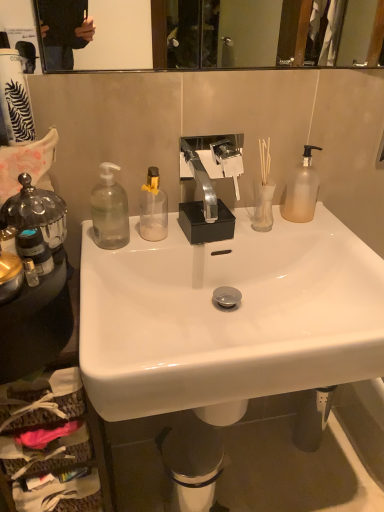
Question: Is white glossy sink at center next to translucent glass vase at center?

Choices:
 (A) no
 (B) yes

Answer: (A)

Question: Considering the relative sizes of white glossy sink at center and translucent glass vase at center in the image provided, is white glossy sink at center taller than translucent glass vase at center?

Choices:
 (A) no
 (B) yes

Answer: (B)

Question: Is the depth of white glossy sink at center greater than that of translucent glass vase at center?

Choices:
 (A) no
 (B) yes

Answer: (A)

Question: Would you say white glossy sink at center contains translucent glass vase at center?

Choices:
 (A) yes
 (B) no

Answer: (B)

Question: Is white glossy sink at center to the right of translucent glass vase at center from the viewer's perspective?

Choices:
 (A) no
 (B) yes

Answer: (A)

Question: From a real-world perspective, is white glossy sink at center physically below translucent glass vase at center?

Choices:
 (A) no
 (B) yes

Answer: (B)

Question: Is translucent glass vase at center shorter than white matte toilet paper at upper left?

Choices:
 (A) no
 (B) yes

Answer: (B)

Question: From a real-world perspective, is translucent glass vase at center on white matte toilet paper at upper left?

Choices:
 (A) yes
 (B) no

Answer: (B)

Question: Can you confirm if translucent glass vase at center is wider than white matte toilet paper at upper left?

Choices:
 (A) yes
 (B) no

Answer: (B)

Question: Is translucent glass vase at center oriented towards white matte toilet paper at upper left?

Choices:
 (A) no
 (B) yes

Answer: (A)

Question: Does translucent glass vase at center appear on the right side of white matte toilet paper at upper left?

Choices:
 (A) yes
 (B) no

Answer: (A)

Question: Can you confirm if translucent glass vase at center is taller than white matte toilet paper at upper left?

Choices:
 (A) yes
 (B) no

Answer: (B)

Question: Is transparent glass bottle at center, which ranks as the second bottle in right-to-left order, next to frosted glass pump bottle at upper right, the 3th bottle from the left?

Choices:
 (A) no
 (B) yes

Answer: (A)